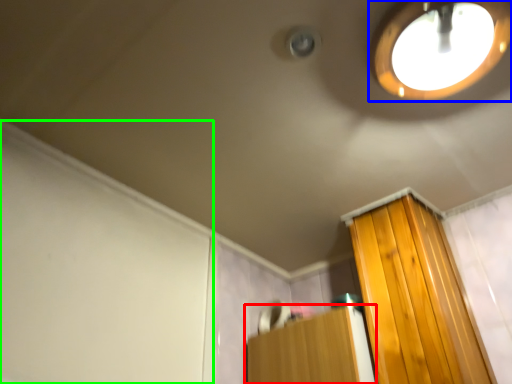
Question: Considering the real-world distances, which object is closest to furniture (highlighted by a red box)? droplight (highlighted by a blue box) or screen door (highlighted by a green box).

Choices:
 (A) droplight
 (B) screen door

Answer: (B)